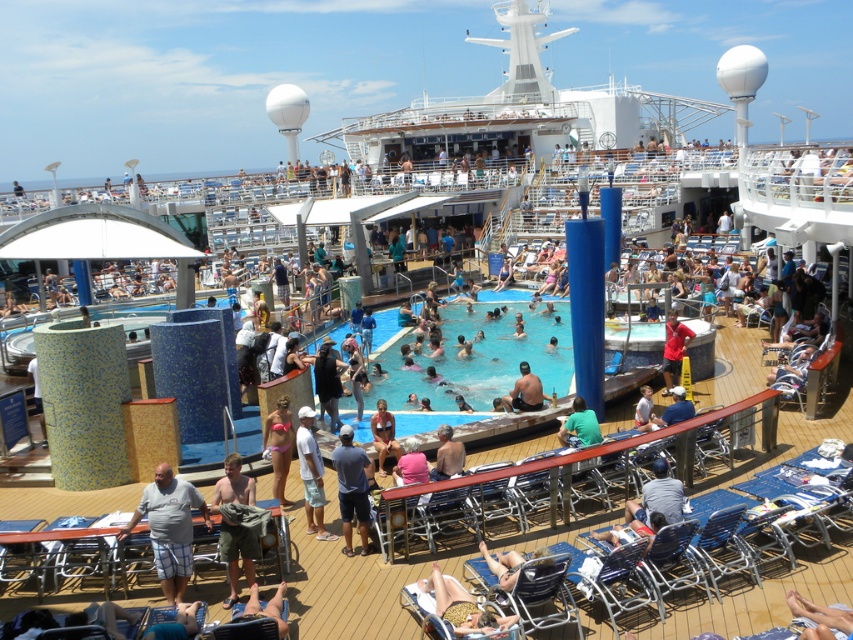
Is dark blue t-shirt at center smaller than white cotton shirt at lower center?

Yes, dark blue t-shirt at center is smaller than white cotton shirt at lower center.

Can you confirm if dark blue t-shirt at center is bigger than white cotton shirt at lower center?

No, dark blue t-shirt at center is not bigger than white cotton shirt at lower center.

The width and height of the screenshot is (853, 640). What are the coordinates of `dark blue t-shirt at center` in the screenshot? It's located at [351, 486].

You are a GUI agent. You are given a task and a screenshot of the screen. Output one action in this format:
    pyautogui.click(x=<x>, y=<y>)
    Task: Click on the dark blue t-shirt at center
    This screenshot has width=853, height=640.
    Given the screenshot: What is the action you would take?
    pyautogui.click(x=351, y=486)

Does blue mosaic tiles at center lie behind dark blue t-shirt at center?

No.

Can you confirm if blue mosaic tiles at center is smaller than dark blue t-shirt at center?

No, blue mosaic tiles at center is not smaller than dark blue t-shirt at center.

Describe the element at coordinates (352, 589) in the screenshot. Image resolution: width=853 pixels, height=640 pixels. I see `blue mosaic tiles at center` at that location.

Where is `blue mosaic tiles at center`? blue mosaic tiles at center is located at coordinates (352, 589).

Between tan skin person at lower right and green fabric shirt at center, which one has less height?

With less height is tan skin person at lower right.

Which is behind, point (805, 632) or point (584, 428)?

The point (584, 428) is more distant.

Where is `tan skin person at lower right`? tan skin person at lower right is located at coordinates (819, 614).